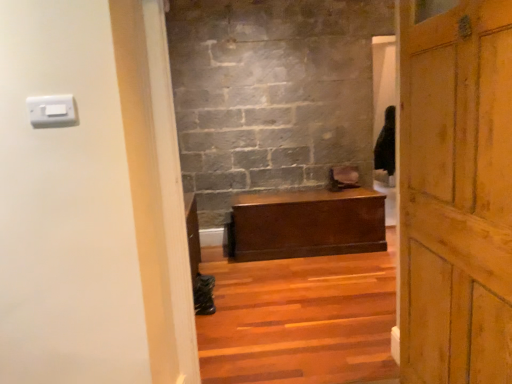
Question: Should I look upward or downward to see wooden stairs at center?

Choices:
 (A) down
 (B) up

Answer: (A)

Question: Can you confirm if wooden door at right is thinner than white plastic light switch at upper left?

Choices:
 (A) no
 (B) yes

Answer: (A)

Question: Is wooden door at right at the left side of white plastic light switch at upper left?

Choices:
 (A) yes
 (B) no

Answer: (B)

Question: Is wooden door at right positioned beyond the bounds of white plastic light switch at upper left?

Choices:
 (A) yes
 (B) no

Answer: (A)

Question: Is wooden door at right closer to the viewer compared to white plastic light switch at upper left?

Choices:
 (A) yes
 (B) no

Answer: (A)

Question: Considering the relative sizes of wooden door at right and white plastic light switch at upper left in the image provided, is wooden door at right bigger than white plastic light switch at upper left?

Choices:
 (A) no
 (B) yes

Answer: (B)

Question: From a real-world perspective, does wooden door at right sit lower than white plastic light switch at upper left?

Choices:
 (A) no
 (B) yes

Answer: (B)

Question: Could you tell me if wooden door at right is facing wooden stairs at center?

Choices:
 (A) yes
 (B) no

Answer: (B)

Question: From the image's perspective, would you say wooden door at right is positioned over wooden stairs at center?

Choices:
 (A) yes
 (B) no

Answer: (A)

Question: Is the depth of wooden door at right greater than that of wooden stairs at center?

Choices:
 (A) no
 (B) yes

Answer: (A)

Question: From a real-world perspective, is wooden door at right under wooden stairs at center?

Choices:
 (A) yes
 (B) no

Answer: (B)

Question: Considering the relative positions of wooden door at right and wooden stairs at center in the image provided, is wooden door at right to the left of wooden stairs at center from the viewer's perspective?

Choices:
 (A) no
 (B) yes

Answer: (A)

Question: Is wooden door at right next to wooden stairs at center and touching it?

Choices:
 (A) yes
 (B) no

Answer: (B)

Question: Does white plastic light switch at upper left have a smaller size compared to matte brown wooden chest at center?

Choices:
 (A) no
 (B) yes

Answer: (B)